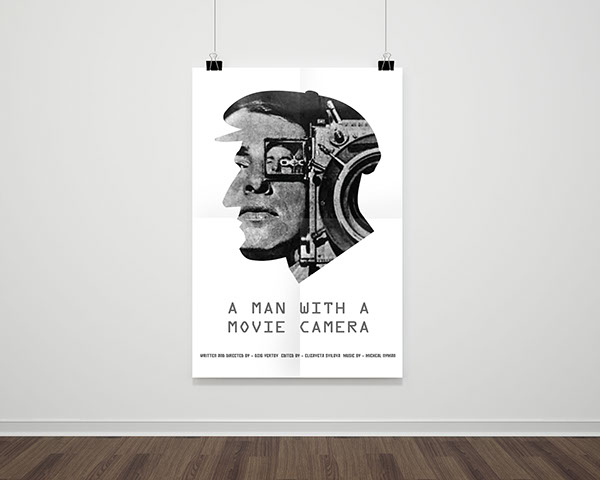
Identify the location of floor. The width and height of the screenshot is (600, 480). (333, 452).